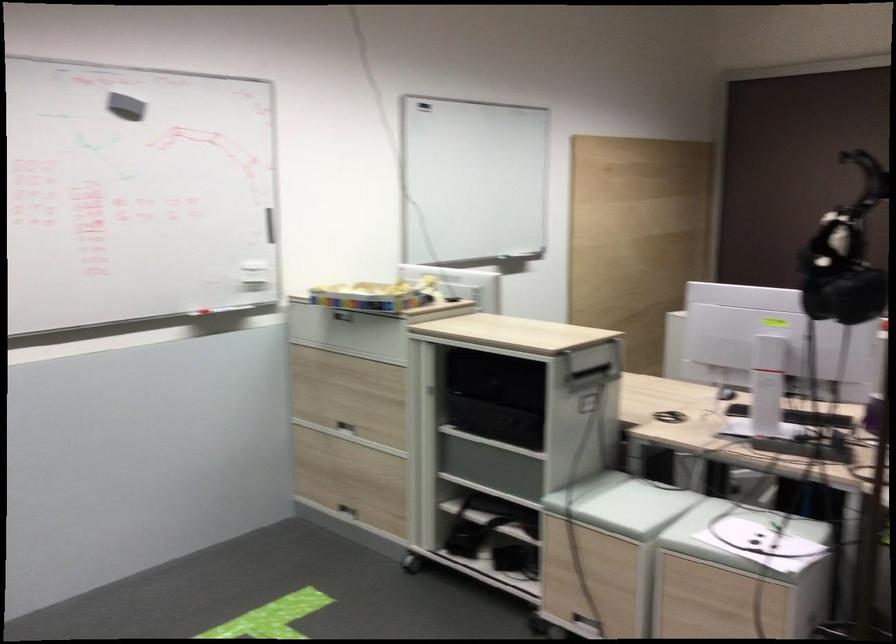
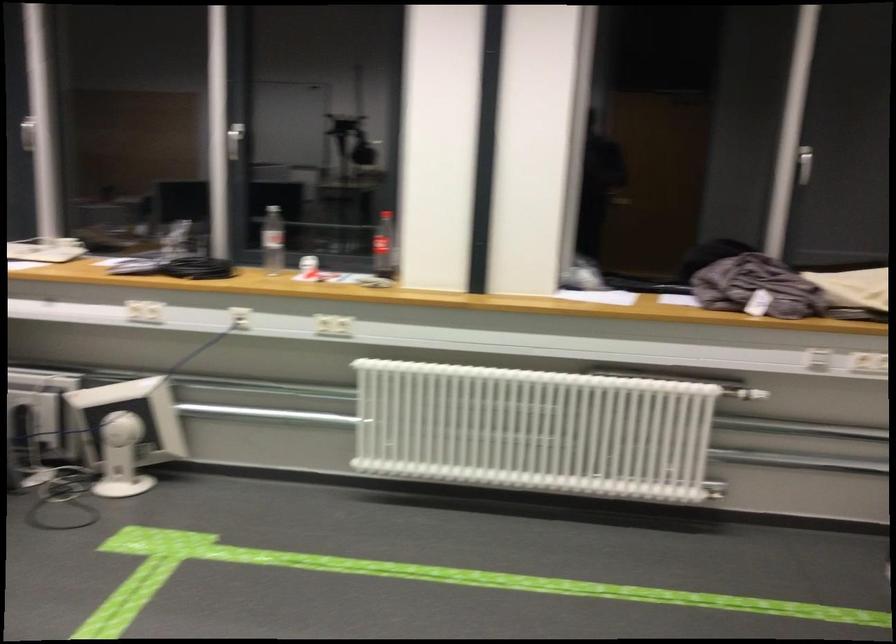
The images are taken continuously from a first-person perspective. In which direction is your viewpoint rotating?

The camera's rotation is toward right-down.